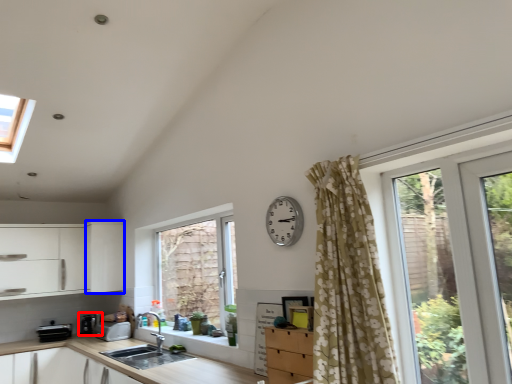
Question: Among these objects, which one is nearest to the camera, appliance (highlighted by a red box) or cabinetry (highlighted by a blue box)?

Choices:
 (A) appliance
 (B) cabinetry

Answer: (B)